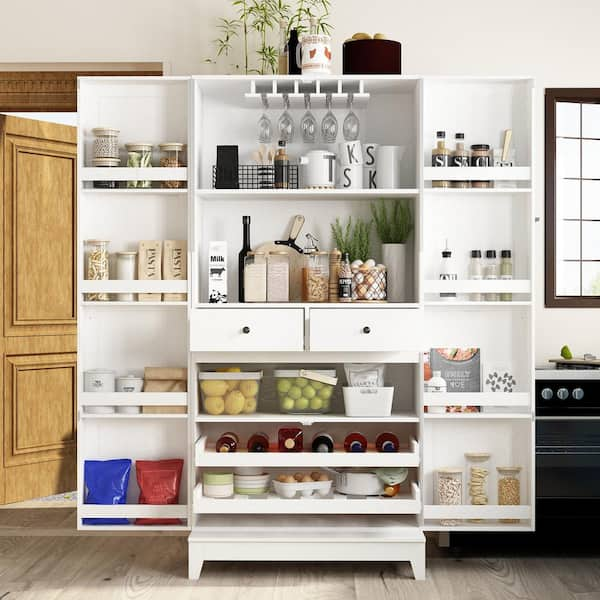
The width and height of the screenshot is (600, 600). Identify the location of boxes. (130, 122), (133, 226), (135, 361), (135, 444), (478, 428), (479, 330), (475, 222), (477, 115).